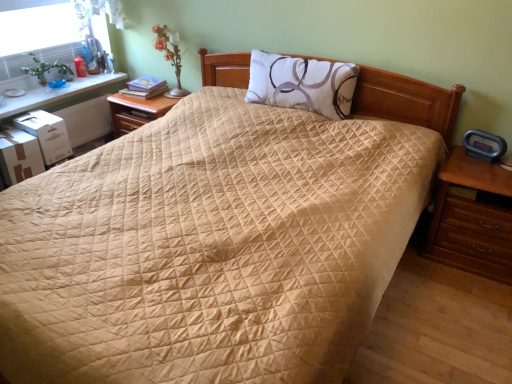
The image size is (512, 384). I want to click on blank space situated above white glossy table at upper left (from a real-world perspective), so click(x=51, y=87).